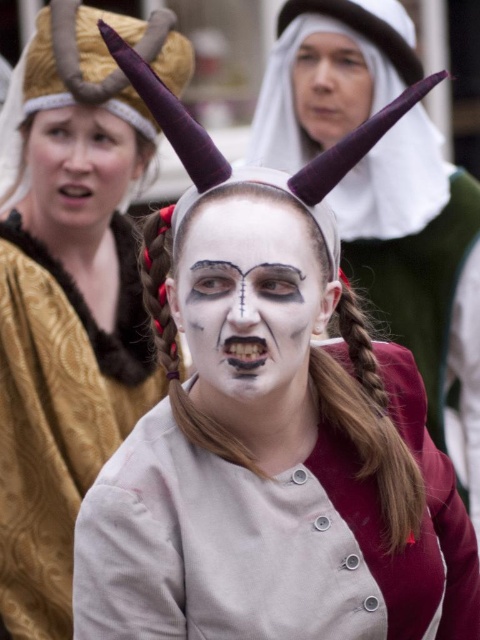
Question: Is white matte face paint at center below smooth white face at upper center?

Choices:
 (A) no
 (B) yes

Answer: (B)

Question: Among these objects, which one is nearest to the camera?

Choices:
 (A) white matte face paint at center
 (B) matte gold headband at upper left
 (C) white matte face at center
 (D) smooth white face at upper center

Answer: (C)

Question: Is white matte face at center wider than smooth white face at upper center?

Choices:
 (A) no
 (B) yes

Answer: (B)

Question: Which object is farther from the camera taking this photo?

Choices:
 (A) white matte face at center
 (B) matte gold headband at upper left

Answer: (B)

Question: Among these points, which one is farthest from the camera?

Choices:
 (A) (93, 164)
 (B) (265, 360)
 (C) (49, 307)

Answer: (A)

Question: Can you confirm if white matte face paint at center is positioned to the right of smooth white face at upper center?

Choices:
 (A) yes
 (B) no

Answer: (B)